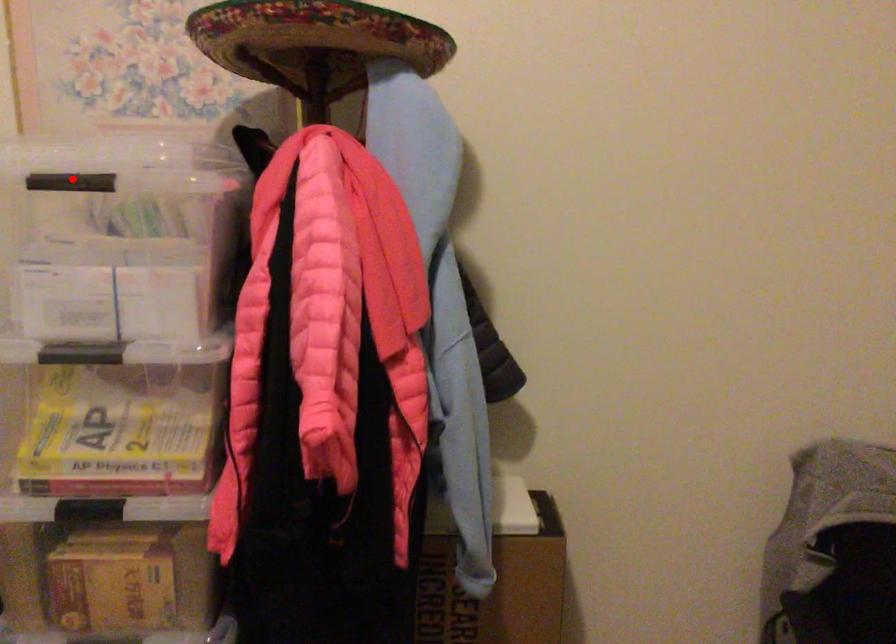
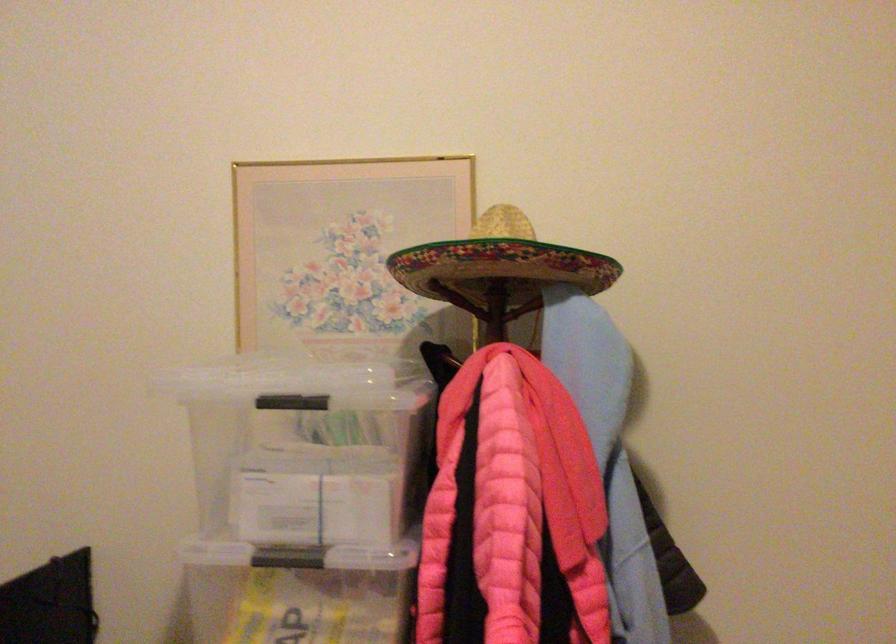
Question: A red point is marked in image1. In image2, is the corresponding 3D point closer to the camera or farther? Reply with the corresponding letter.

Choices:
 (A) The corresponding 3D point is closer.
 (B) The corresponding 3D point is farther.

Answer: (B)